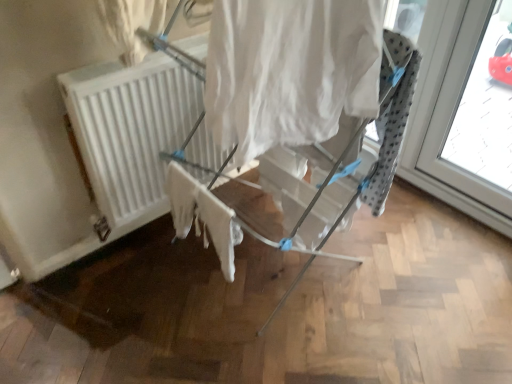
Question: From the image's perspective, relative to white fabric drying rack at center, is white cotton cloth at center above or below?

Choices:
 (A) above
 (B) below

Answer: (B)

Question: Is point (197, 236) closer or farther from the camera than point (250, 233)?

Choices:
 (A) closer
 (B) farther

Answer: (B)

Question: Which object is the farthest from the transparent glass window at right?

Choices:
 (A) white fabric drying rack at center
 (B) white matte radiator at center
 (C) white fabric curtain at center
 (D) white cotton cloth at center

Answer: (B)

Question: Estimate the real-world distances between objects in this image. Which object is farther from the white cotton cloth at center?

Choices:
 (A) white matte radiator at center
 (B) white fabric drying rack at center
 (C) transparent glass window at right
 (D) white fabric curtain at center

Answer: (C)